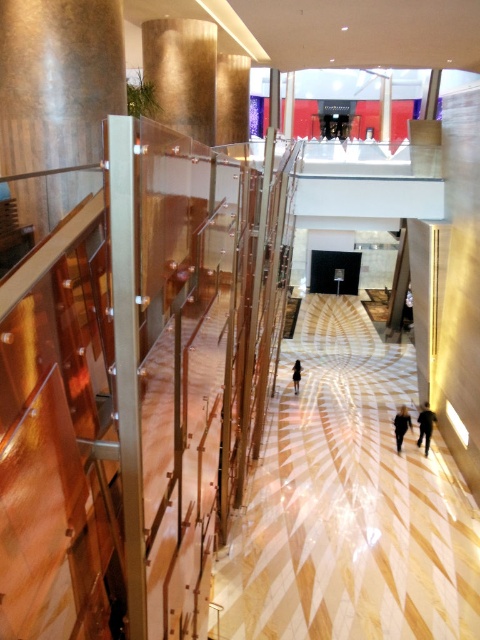
Question: Which of the following is the farthest from the observer?

Choices:
 (A) dark gray fabric person at lower right
 (B) blurred black clothing at center
 (C) dark brown leather jacket at center

Answer: (C)

Question: Does white glossy floor at center have a smaller size compared to blurred black clothing at center?

Choices:
 (A) yes
 (B) no

Answer: (B)

Question: Can you confirm if dark gray fabric person at lower right is wider than blurred black clothing at center?

Choices:
 (A) no
 (B) yes

Answer: (B)

Question: Can you confirm if white glossy floor at center is bigger than dark brown leather jacket at center?

Choices:
 (A) yes
 (B) no

Answer: (A)

Question: Which point is farther from the camera taking this photo?

Choices:
 (A) (418, 442)
 (B) (381, 508)

Answer: (A)

Question: Based on their relative distances, which object is nearer to the dark brown leather jacket at center?

Choices:
 (A) white glossy floor at center
 (B) blurred black clothing at center

Answer: (A)